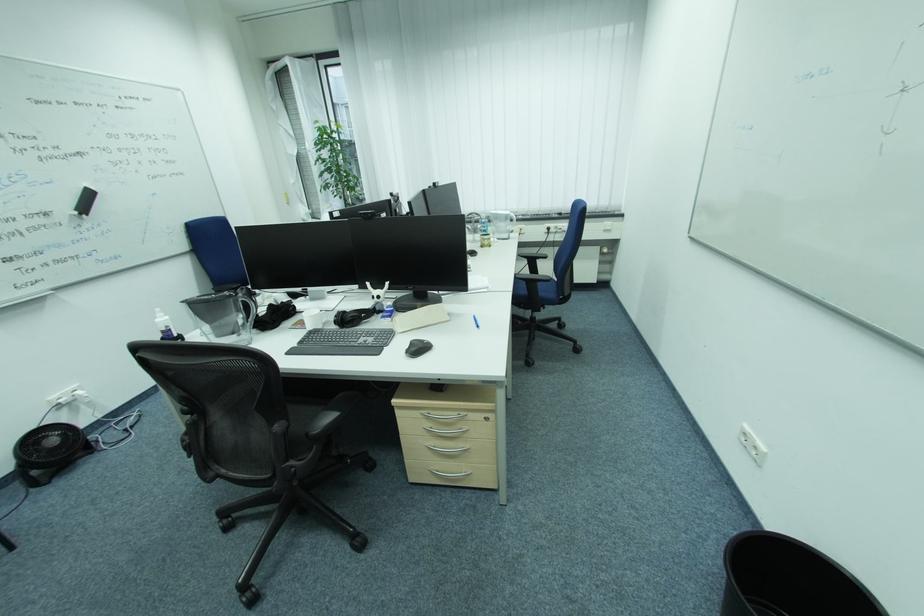
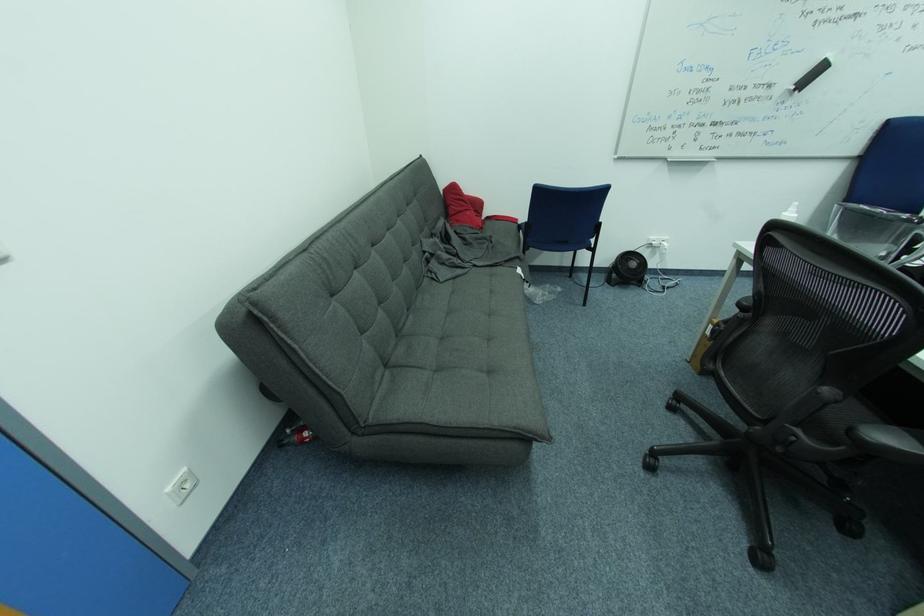
Locate, in the second image, the point that corresponds to pixel 313 435 in the first image.

(858, 430)